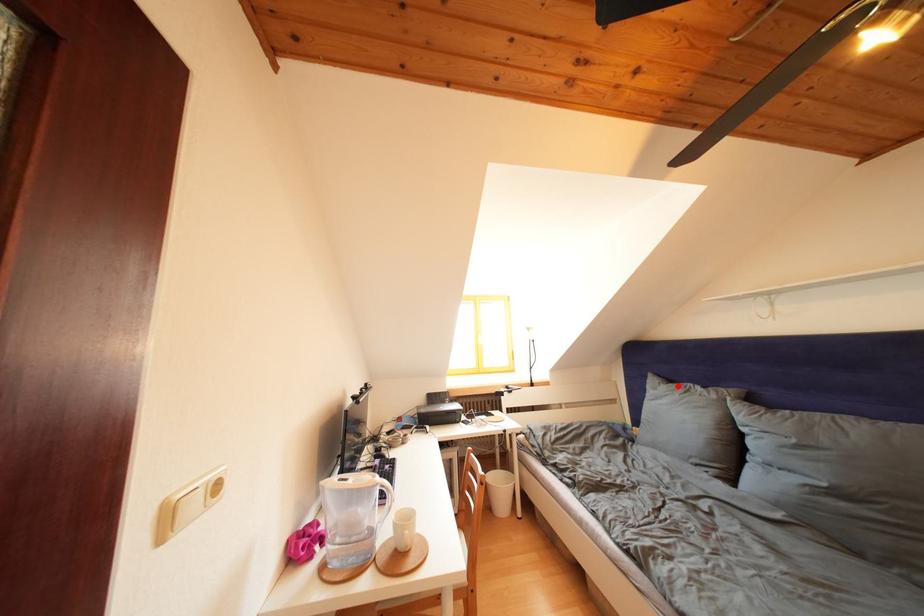
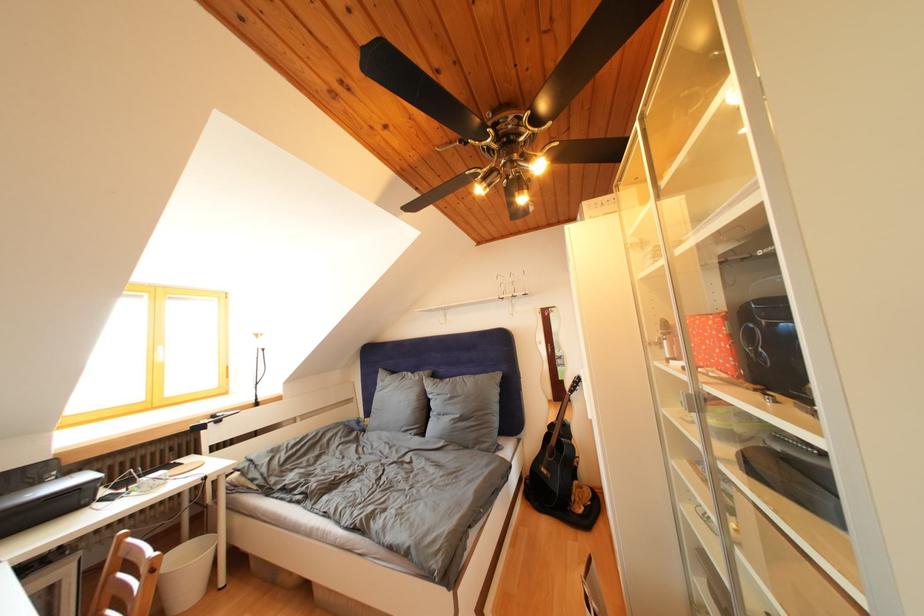
Locate, in the second image, the point that corresponds to the highlighted location in the first image.

(400, 378)